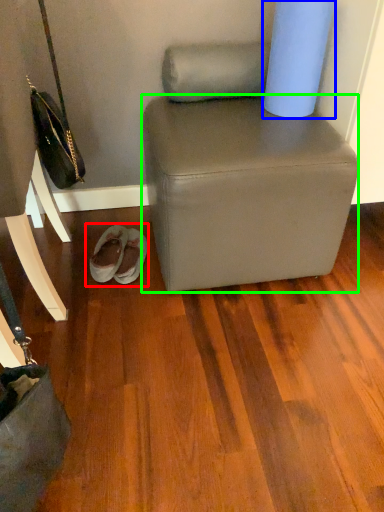
Question: Which object is positioned farthest from footwear (highlighted by a red box)? Select from toilet paper (highlighted by a blue box) and stool (highlighted by a green box).

Choices:
 (A) toilet paper
 (B) stool

Answer: (A)